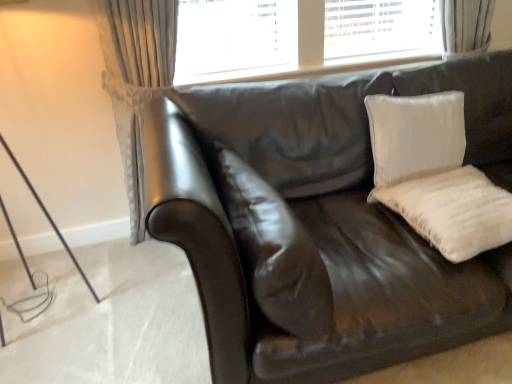
Question: Is the position of white textured pillow at upper right, acting as the 2th pillow starting from the left, less distant than that of shiny brown leather couch at center?

Choices:
 (A) no
 (B) yes

Answer: (A)

Question: Does white textured pillow at upper right, which ranks as the 2th pillow in right-to-left order, have a larger size compared to shiny brown leather couch at center?

Choices:
 (A) yes
 (B) no

Answer: (B)

Question: Is there a large distance between white textured pillow at upper right, which ranks as the 2th pillow in right-to-left order, and shiny brown leather couch at center?

Choices:
 (A) yes
 (B) no

Answer: (B)

Question: Can you confirm if white textured pillow at upper right, which ranks as the 2th pillow in right-to-left order, is wider than shiny brown leather couch at center?

Choices:
 (A) yes
 (B) no

Answer: (B)

Question: Does white textured pillow at upper right, which ranks as the 2th pillow in right-to-left order, have a smaller size compared to shiny brown leather couch at center?

Choices:
 (A) yes
 (B) no

Answer: (A)

Question: In terms of width, does shiny brown leather couch at center look wider or thinner when compared to white cotton pillow at right, which appears as the 1th pillow when viewed from the right?

Choices:
 (A) wide
 (B) thin

Answer: (A)

Question: Considering their positions, is shiny brown leather couch at center located in front of or behind white cotton pillow at right, the 3th pillow when ordered from left to right?

Choices:
 (A) behind
 (B) front

Answer: (B)

Question: From a real-world perspective, is shiny brown leather couch at center physically located above or below white cotton pillow at right, which appears as the 1th pillow when viewed from the right?

Choices:
 (A) above
 (B) below

Answer: (B)

Question: Considering the positions of shiny brown leather couch at center and white cotton pillow at right, which appears as the 1th pillow when viewed from the right, in the image, is shiny brown leather couch at center taller or shorter than white cotton pillow at right, which appears as the 1th pillow when viewed from the right,?

Choices:
 (A) short
 (B) tall

Answer: (B)

Question: Looking at their shapes, would you say white cotton pillow at right, the 3th pillow when ordered from left to right, is wider or thinner than white textured pillow at upper right, which ranks as the 2th pillow in right-to-left order?

Choices:
 (A) thin
 (B) wide

Answer: (B)

Question: From a real-world perspective, is white cotton pillow at right, the 3th pillow when ordered from left to right, physically located above or below white textured pillow at upper right, which ranks as the 2th pillow in right-to-left order?

Choices:
 (A) above
 (B) below

Answer: (B)

Question: Visually, is white cotton pillow at right, which appears as the 1th pillow when viewed from the right, positioned to the left or to the right of white textured pillow at upper right, which ranks as the 2th pillow in right-to-left order?

Choices:
 (A) right
 (B) left

Answer: (A)

Question: From their relative heights in the image, would you say white cotton pillow at right, which appears as the 1th pillow when viewed from the right, is taller or shorter than white textured pillow at upper right, which ranks as the 2th pillow in right-to-left order?

Choices:
 (A) short
 (B) tall

Answer: (A)

Question: Is point (435, 160) closer or farther from the camera than point (412, 180)?

Choices:
 (A) closer
 (B) farther

Answer: (B)

Question: From a real-world perspective, relative to white cotton pillow at right, the 3th pillow when ordered from left to right, is white textured pillow at upper right, which ranks as the 2th pillow in right-to-left order, vertically above or below?

Choices:
 (A) below
 (B) above

Answer: (B)